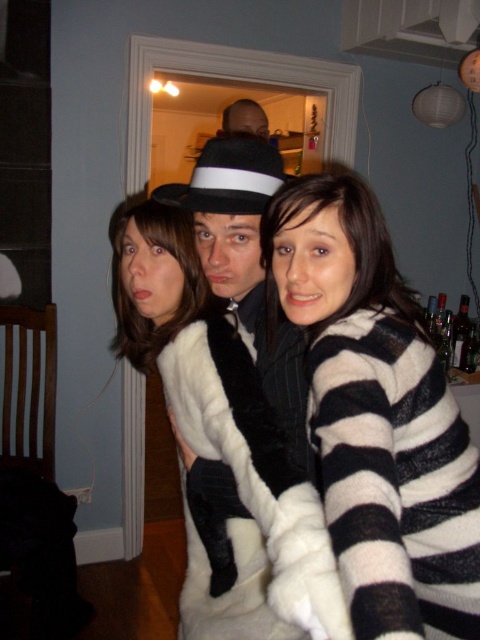
You are a photographer adjusting the lighting for a group photo. You need to ensure that the black and white striped sweater at center and the white fur coat at center are evenly lit. Given their current positions, is the distance between them sufficient to allow you to place a reflector between them without it being in the frame?

The distance between the black and white striped sweater at center and the white fur coat at center is 7.89 inches. Since the reflector typically requires at least 6 inches of space to be placed effectively between subjects, the distance is sufficient for the reflector to fit without being in the frame.

You are trying to decide which clothing item to take for a photoshoot. Both the black and white striped sweater at center and the white fur coat at center are available. Based on their sizes, which one would be taller?

The black and white striped sweater at center is taller than the white fur coat at center, so the sweater would be the taller option.